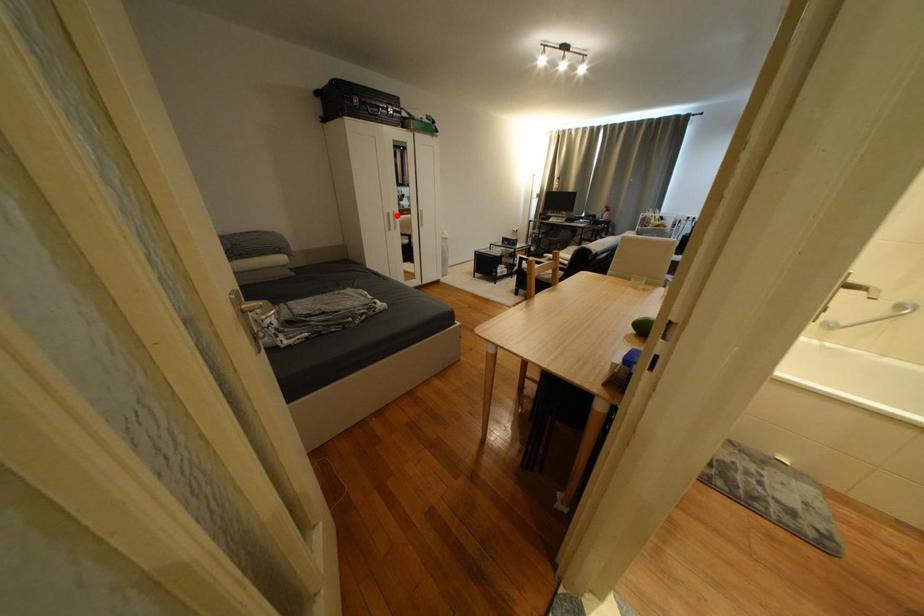
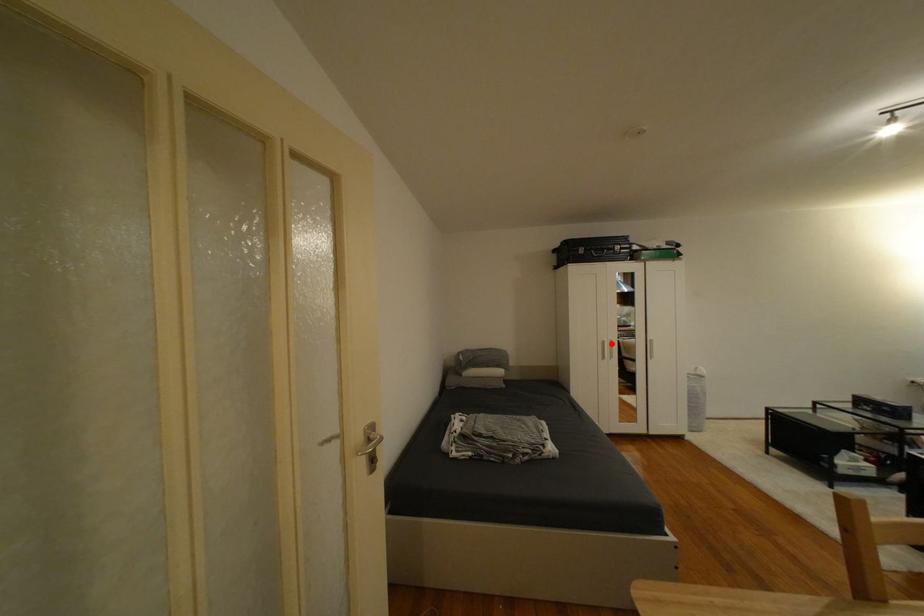
I am providing you with two images of the same scene from different viewpoints. A red point is marked on the first image and another point is marked on the second image. Do the highlighted points in image1 and image2 indicate the same real-world spot?

Yes